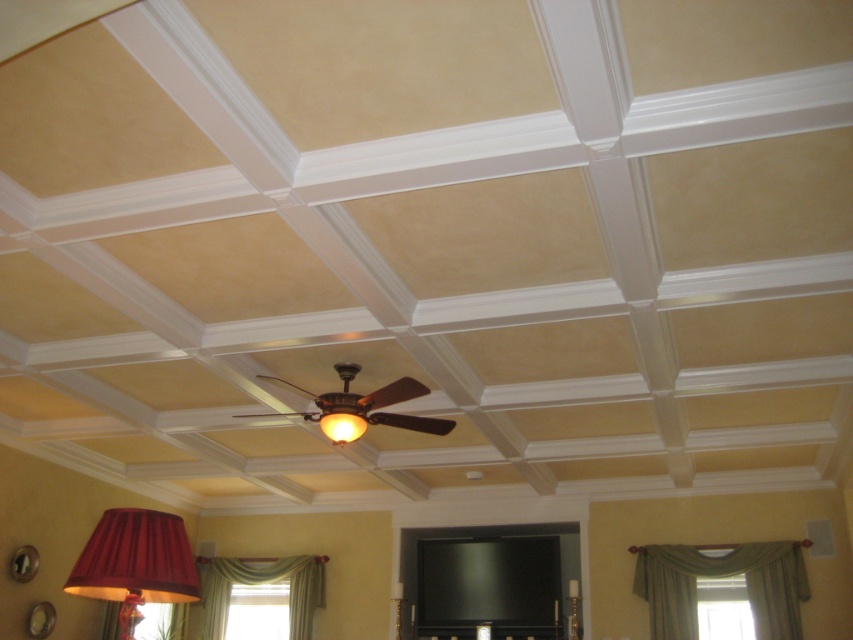
Between green fabric curtain at lower left and wooden ceiling fan at center, which one is positioned higher?

wooden ceiling fan at center is above.

Does green fabric curtain at lower left have a smaller size compared to wooden ceiling fan at center?

Correct, green fabric curtain at lower left occupies less space than wooden ceiling fan at center.

What do you see at coordinates (260, 582) in the screenshot? The width and height of the screenshot is (853, 640). I see `green fabric curtain at lower left` at bounding box center [260, 582].

The width and height of the screenshot is (853, 640). Find the location of `green fabric curtain at lower left`. green fabric curtain at lower left is located at coordinates (260, 582).

Does matte red lampshade at lower left appear over green fabric curtain at lower left?

Indeed, matte red lampshade at lower left is positioned over green fabric curtain at lower left.

Who is more forward, (149,566) or (200,579)?

Point (149,566) is in front.

Which is in front, point (80, 577) or point (308, 580)?

Positioned in front is point (80, 577).

Find the location of `matte red lampshade at lower left`. matte red lampshade at lower left is located at coordinates (135, 563).

Which is above, matte red lampshade at lower left or matte gold lampshade at center?

matte gold lampshade at center is higher up.

Is matte red lampshade at lower left smaller than matte gold lampshade at center?

Actually, matte red lampshade at lower left might be larger than matte gold lampshade at center.

Find the location of a particular element. matte red lampshade at lower left is located at coordinates (135, 563).